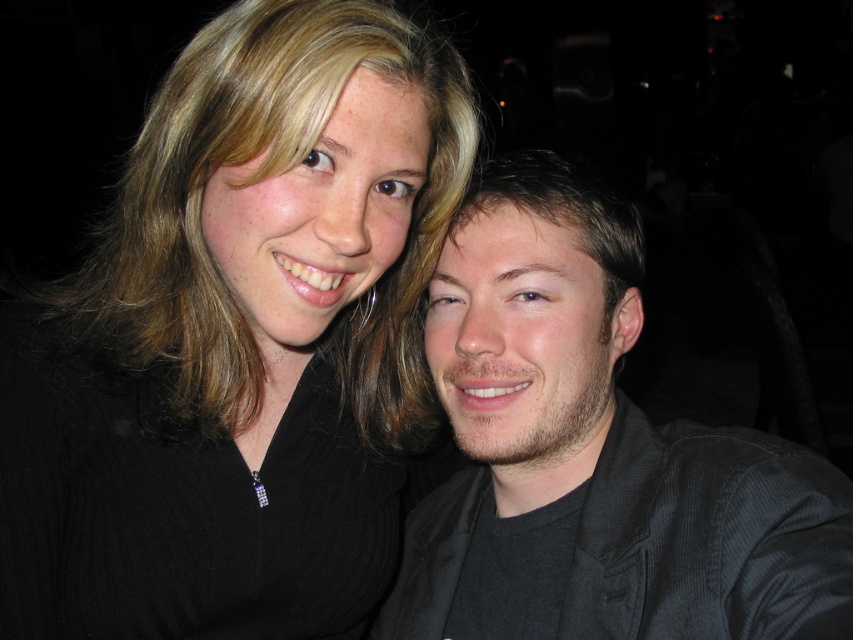
Question: Can you confirm if matte black hair at upper left is wider than dark gray textured shirt at right?

Choices:
 (A) no
 (B) yes

Answer: (B)

Question: Is matte black hair at upper left to the left of dark gray textured shirt at right from the viewer's perspective?

Choices:
 (A) yes
 (B) no

Answer: (A)

Question: From the image, what is the correct spatial relationship of matte black hair at upper left in relation to dark gray textured shirt at right?

Choices:
 (A) below
 (B) above

Answer: (B)

Question: Which point is closer to the camera?

Choices:
 (A) matte black hair at upper left
 (B) dark gray textured shirt at right

Answer: (B)